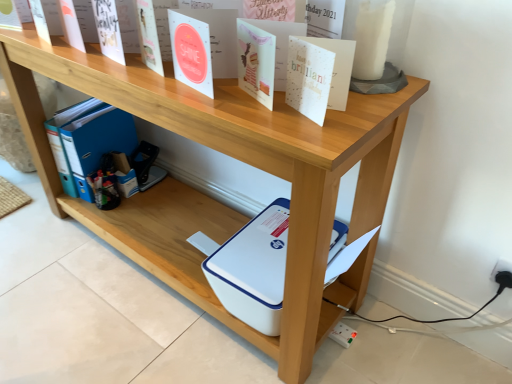
What is the approximate width of white paper at upper center, which is the 2th paperback book from back to front?

white paper at upper center, which is the 2th paperback book from back to front, is 0.64 inches wide.

Describe the element at coordinates (109, 29) in the screenshot. This screenshot has width=512, height=384. I see `white matte paper at upper center, which is the 1th paperback book from back to front` at that location.

This screenshot has height=384, width=512. What do you see at coordinates (502, 273) in the screenshot? I see `white plastic electric outlet at lower right` at bounding box center [502, 273].

The height and width of the screenshot is (384, 512). In order to click on white paper at upper center, the 1th paperback book positioned from the right in this screenshot , I will do `click(309, 78)`.

Is white matte paper at upper center, which ranks as the first paperback book in left-to-right order, taller or shorter than white plastic electric outlet at lower right?

Considering their sizes, white matte paper at upper center, which ranks as the first paperback book in left-to-right order, has more height than white plastic electric outlet at lower right.

From the picture: Is white matte paper at upper center, arranged as the second paperback book when ordered from the bottom, turned away from white plastic electric outlet at lower right?

No, white matte paper at upper center, arranged as the second paperback book when ordered from the bottom,'s orientation is not away from white plastic electric outlet at lower right.

How far apart are white matte paper at upper center, the 2th paperback book from the front, and white plastic electric outlet at lower right?

They are 3.77 feet apart.

From the image's perspective, which one is positioned higher, white matte paper at upper center, which ranks as the second paperback book in right-to-left order, or white plastic electric outlet at lower right?

From the image's view, white matte paper at upper center, which ranks as the second paperback book in right-to-left order, is above.

Which object is positioned more to the left, white plastic electric outlet at lower right or white paper at upper center, which is the 1th paperback book in bottom-to-top order?

white paper at upper center, which is the 1th paperback book in bottom-to-top order, is more to the left.

Who is more distant, white plastic electric outlet at lower right or white paper at upper center, positioned as the first paperback book in front-to-back order?

Positioned behind is white plastic electric outlet at lower right.

Is white plastic electric outlet at lower right surrounding white paper at upper center, the 1th paperback book positioned from the right?

No, white plastic electric outlet at lower right does not contain white paper at upper center, the 1th paperback book positioned from the right.

Between white plastic electric outlet at lower right and white paper at upper center, positioned as the first paperback book in front-to-back order, which one has smaller size?

With smaller size is white plastic electric outlet at lower right.

Does white matte paper at upper center, which is the 1th paperback book from back to front, have a greater width compared to white paper at upper center, which is the 1th paperback book in bottom-to-top order?

Yes.

Considering the relative sizes of white matte paper at upper center, which ranks as the first paperback book in left-to-right order, and white paper at upper center, the 2th paperback book viewed from the top, in the image provided, is white matte paper at upper center, which ranks as the first paperback book in left-to-right order, bigger than white paper at upper center, the 2th paperback book viewed from the top,?

Yes.

Consider the image. Which is less distant, [112,15] or [301,98]?

The point [301,98] is in front.

Image resolution: width=512 pixels, height=384 pixels. In order to click on paperback book on the left side of white paper at upper center, which is the 1th paperback book in bottom-to-top order in this screenshot , I will do `click(109, 29)`.

Does white paper at upper center, which is the 2th paperback book from back to front, have a lesser height compared to white plastic electric outlet at lower right?

Incorrect, the height of white paper at upper center, which is the 2th paperback book from back to front, does not fall short of that of white plastic electric outlet at lower right.

Is white paper at upper center, the 2th paperback book viewed from the top, completely or partially outside of white plastic electric outlet at lower right?

white paper at upper center, the 2th paperback book viewed from the top, lies outside white plastic electric outlet at lower right's area.

In the image, is white paper at upper center, which is the 2th paperback book from back to front, on the left side or the right side of white plastic electric outlet at lower right?

Based on their positions, white paper at upper center, which is the 2th paperback book from back to front, is located to the left of white plastic electric outlet at lower right.

Considering the positions of objects white plastic electric outlet at lower right and white matte paper at upper center, marked as the first paperback book in a top-to-bottom arrangement, in the image provided, who is more to the right, white plastic electric outlet at lower right or white matte paper at upper center, marked as the first paperback book in a top-to-bottom arrangement,?

white plastic electric outlet at lower right.

Is white plastic electric outlet at lower right taller or shorter than white matte paper at upper center, which ranks as the second paperback book in right-to-left order?

In the image, white plastic electric outlet at lower right appears to be shorter than white matte paper at upper center, which ranks as the second paperback book in right-to-left order.

From the image's perspective, relative to white matte paper at upper center, which ranks as the second paperback book in right-to-left order, is white plastic electric outlet at lower right above or below?

white plastic electric outlet at lower right is situated lower than white matte paper at upper center, which ranks as the second paperback book in right-to-left order, in the image.

Would you say white plastic electric outlet at lower right is a long distance from white matte paper at upper center, which is the 1th paperback book from back to front?

Yes, white plastic electric outlet at lower right and white matte paper at upper center, which is the 1th paperback book from back to front, are located far from each other.

Is white paper at upper center, positioned as the first paperback book in front-to-back order, inside or outside of white matte paper at upper center, which ranks as the first paperback book in left-to-right order?

The correct answer is: outside.

Would you consider white paper at upper center, the 2th paperback book viewed from the top, to be distant from white matte paper at upper center, which is the 1th paperback book from back to front?

No, white paper at upper center, the 2th paperback book viewed from the top, is not far from white matte paper at upper center, which is the 1th paperback book from back to front.

Is white matte paper at upper center, which is the 1th paperback book from back to front, at the back of white paper at upper center, the second paperback book viewed from the left?

That's not correct — white paper at upper center, the second paperback book viewed from the left, is not looking away from white matte paper at upper center, which is the 1th paperback book from back to front.

Can you confirm if white paper at upper center, the 2th paperback book viewed from the top, is smaller than white matte paper at upper center, marked as the first paperback book in a top-to-bottom arrangement?

Indeed, white paper at upper center, the 2th paperback book viewed from the top, has a smaller size compared to white matte paper at upper center, marked as the first paperback book in a top-to-bottom arrangement.

There is a white plastic electric outlet at lower right. Identify the location of the 2nd paperback book above it (from a real-world perspective). (109, 29).

Where is `electric outlet on the right of white paper at upper center, the second paperback book viewed from the left`? This screenshot has width=512, height=384. electric outlet on the right of white paper at upper center, the second paperback book viewed from the left is located at coordinates (502, 273).

Which object lies further to the anchor point white plastic electric outlet at lower right, white matte paper at upper center, which is the 1th paperback book from back to front, or white paper at upper center, the 2th paperback book viewed from the top?

white matte paper at upper center, which is the 1th paperback book from back to front.

From the image, which object appears to be farther from white matte paper at upper center, marked as the first paperback book in a top-to-bottom arrangement, white plastic electric outlet at lower right or white paper at upper center, which is the 2th paperback book from back to front?

Based on the image, white plastic electric outlet at lower right appears to be further to white matte paper at upper center, marked as the first paperback book in a top-to-bottom arrangement.

Looking at the image, which one is located closer to white paper at upper center, the 1th paperback book positioned from the right, white plastic electric outlet at lower right or white matte paper at upper center, marked as the first paperback book in a top-to-bottom arrangement?

white matte paper at upper center, marked as the first paperback book in a top-to-bottom arrangement, lies closer to white paper at upper center, the 1th paperback book positioned from the right, than the other object.

Considering their positions, is white matte paper at upper center, which ranks as the second paperback book in right-to-left order, positioned further to white paper at upper center, which is the 2th paperback book from back to front, than white plastic electric outlet at lower right?

white plastic electric outlet at lower right is further to white paper at upper center, which is the 2th paperback book from back to front.

Based on the photo, when comparing their distances from white matte paper at upper center, the 2th paperback book from the front, does white paper at upper center, which is the 1th paperback book in bottom-to-top order, or white plastic electric outlet at lower right seem further?

Based on the image, white plastic electric outlet at lower right appears to be further to white matte paper at upper center, the 2th paperback book from the front.

From the image, which object appears to be farther from white plastic electric outlet at lower right, white paper at upper center, positioned as the first paperback book in front-to-back order, or white matte paper at upper center, marked as the first paperback book in a top-to-bottom arrangement?

Based on the image, white matte paper at upper center, marked as the first paperback book in a top-to-bottom arrangement, appears to be further to white plastic electric outlet at lower right.

Find the location of a particular element. The image size is (512, 384). paperback book situated between white matte paper at upper center, which is the 1th paperback book from back to front, and white plastic electric outlet at lower right from left to right is located at coordinates (309, 78).